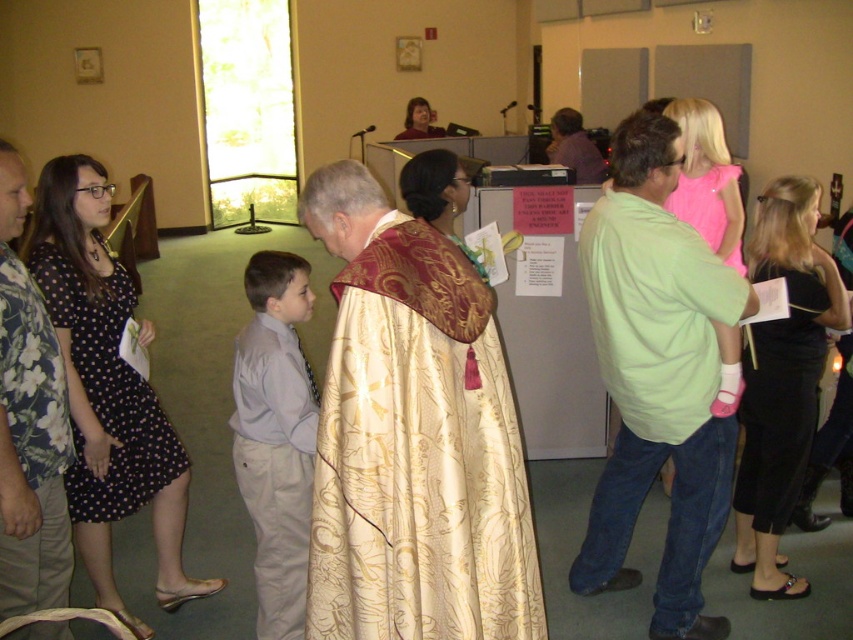
You are attending a religious ceremony and see the black dotted dress at left and the gold brocade robe at center. Which one is positioned more to the left side of the scene?

The black dotted dress at left is positioned more to the left side of the scene compared to the gold brocade robe at center.

Looking at this image, you are a photographer trying to capture a group photo of the two men wearing the light gray cotton shirt at center and the matte purple shirt at center. Since you want to ensure both shirts are visible in the photo, which shirt should you focus on first to avoid blurring due to their thickness?

A: The light gray cotton shirt at center is thinner than the matte purple shirt at center, so you should focus on the matte purple shirt at center first as it is thicker and might require more precise focusing to capture details without blurring.

You are a photographer at the event and need to capture a photo that includes both the black dotted dress at left and the matte gold robe at upper center. Which object should you focus on first to ensure both are in frame?

The black dotted dress at left is much taller than the matte gold robe at upper center, so you should focus on the black dotted dress at left first to ensure both are in frame.